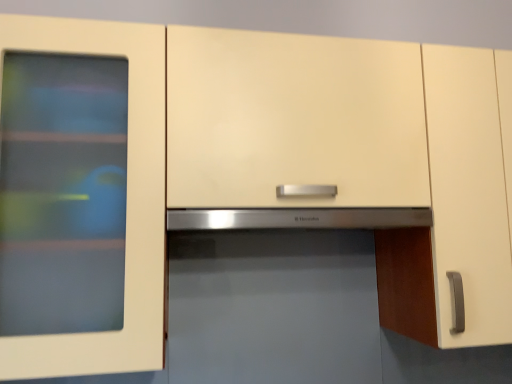
Question: Does stainless steel exhaust hood at center have a smaller size compared to satin stainless steel microwave at center?

Choices:
 (A) no
 (B) yes

Answer: (B)

Question: From the image's perspective, is stainless steel exhaust hood at center below satin stainless steel microwave at center?

Choices:
 (A) yes
 (B) no

Answer: (B)

Question: From a real-world perspective, is stainless steel exhaust hood at center located beneath satin stainless steel microwave at center?

Choices:
 (A) no
 (B) yes

Answer: (A)

Question: From a real-world perspective, is stainless steel exhaust hood at center on satin stainless steel microwave at center?

Choices:
 (A) no
 (B) yes

Answer: (B)

Question: Considering the relative sizes of stainless steel exhaust hood at center and satin stainless steel microwave at center in the image provided, is stainless steel exhaust hood at center taller than satin stainless steel microwave at center?

Choices:
 (A) yes
 (B) no

Answer: (B)

Question: Is stainless steel exhaust hood at center at the left side of satin stainless steel microwave at center?

Choices:
 (A) yes
 (B) no

Answer: (A)

Question: Is satin stainless steel microwave at center facing towards stainless steel exhaust hood at center?

Choices:
 (A) yes
 (B) no

Answer: (B)

Question: Can you confirm if satin stainless steel microwave at center is shorter than stainless steel exhaust hood at center?

Choices:
 (A) no
 (B) yes

Answer: (A)

Question: Is satin stainless steel microwave at center taller than stainless steel exhaust hood at center?

Choices:
 (A) no
 (B) yes

Answer: (B)

Question: Is satin stainless steel microwave at center located outside stainless steel exhaust hood at center?

Choices:
 (A) no
 (B) yes

Answer: (B)

Question: Is the position of satin stainless steel microwave at center less distant than that of stainless steel exhaust hood at center?

Choices:
 (A) yes
 (B) no

Answer: (A)

Question: Is stainless steel exhaust hood at center at the back of satin stainless steel microwave at center?

Choices:
 (A) yes
 (B) no

Answer: (B)

Question: In the image, is stainless steel exhaust hood at center positioned in front of or behind satin stainless steel microwave at center?

Choices:
 (A) behind
 (B) front

Answer: (A)